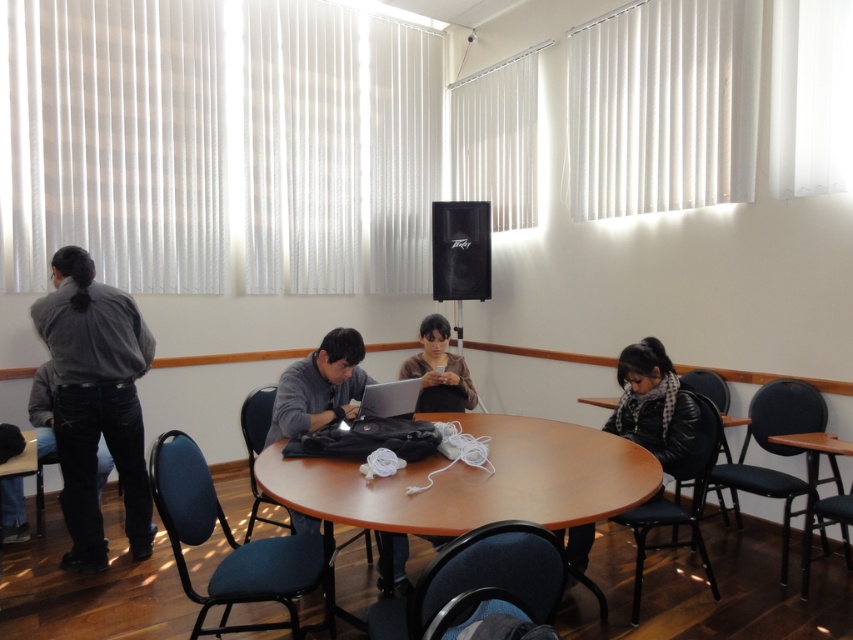
Question: Does gray matte shirt at left have a lesser width compared to black leather jacket at lower right?

Choices:
 (A) yes
 (B) no

Answer: (B)

Question: Among these objects, which one is nearest to the camera?

Choices:
 (A) wooden table at lower right
 (B) black matte speaker at upper center
 (C) gray sweater at center

Answer: (C)

Question: Is wooden table at lower right below silver metallic laptop at center?

Choices:
 (A) yes
 (B) no

Answer: (A)

Question: Which is nearer to the gray sweater at center?

Choices:
 (A) silver metallic laptop at center
 (B) wooden table at center
 (C) black matte speaker at upper center

Answer: (A)

Question: Does gray sweater at center have a smaller size compared to matte black shirt at center?

Choices:
 (A) yes
 (B) no

Answer: (B)

Question: Among these points, which one is farthest from the camera?

Choices:
 (A) (639, 365)
 (B) (76, 531)
 (C) (592, 401)

Answer: (C)